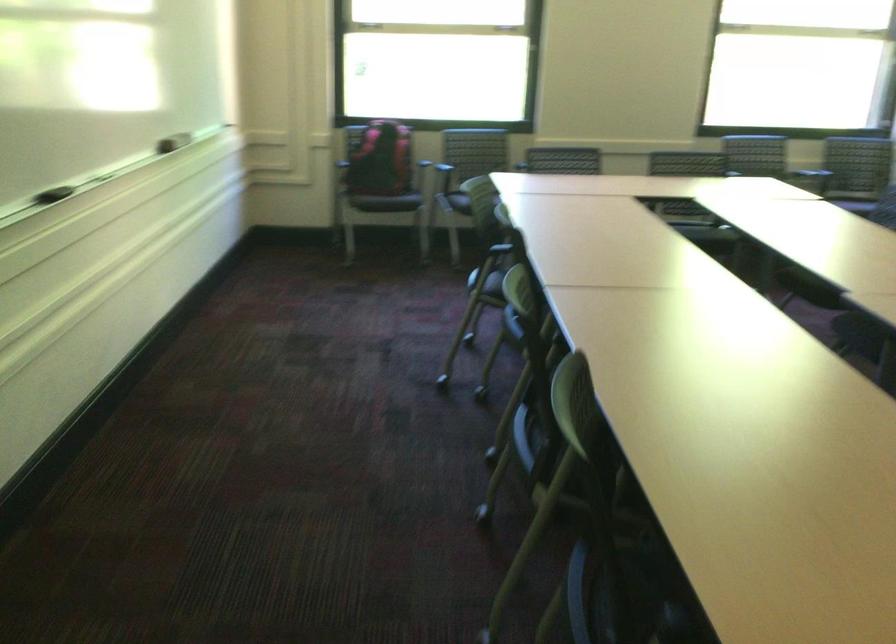
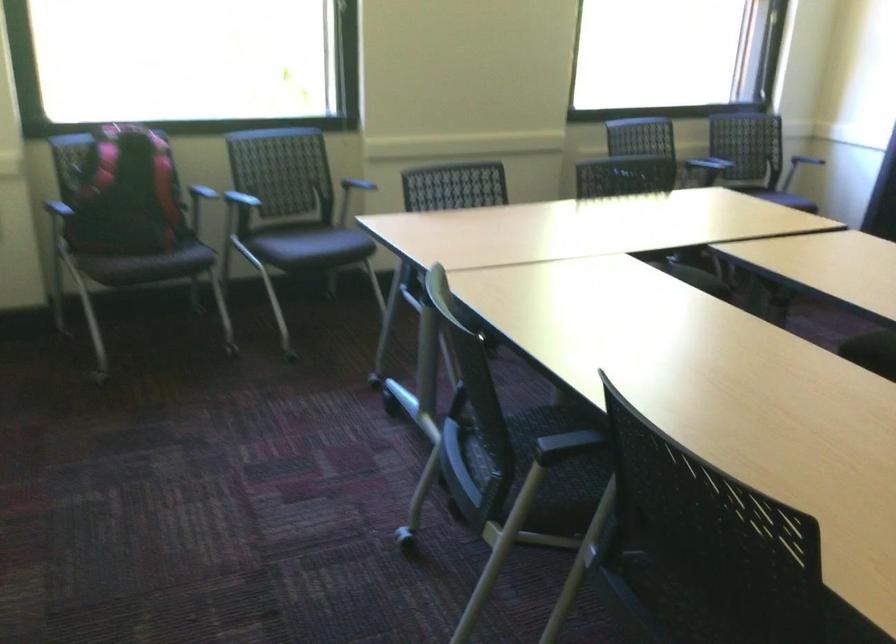
Find the pixel in the second image that matches (x=371, y=147) in the first image.

(125, 194)